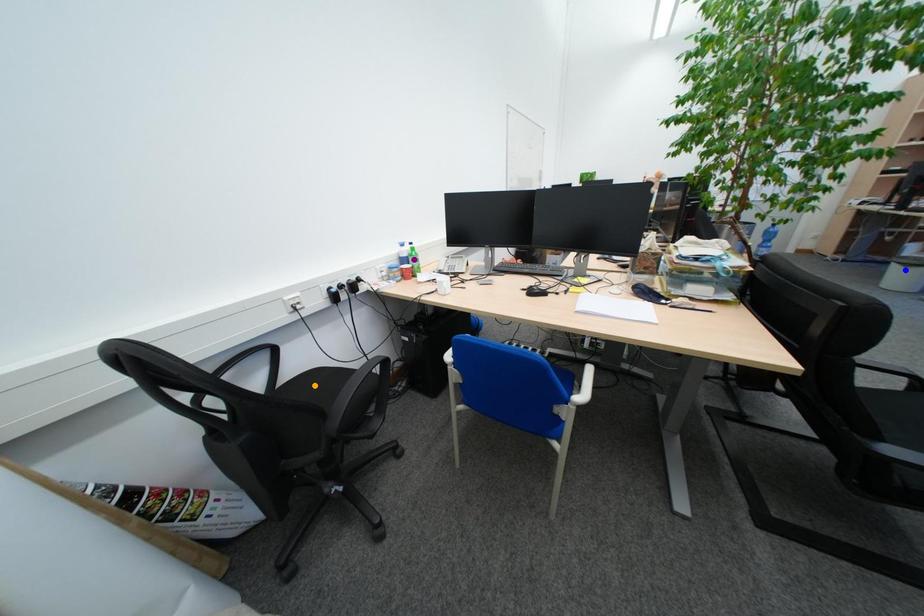
Order these from nearest to farthest:
purple point, orange point, blue point

blue point, purple point, orange point